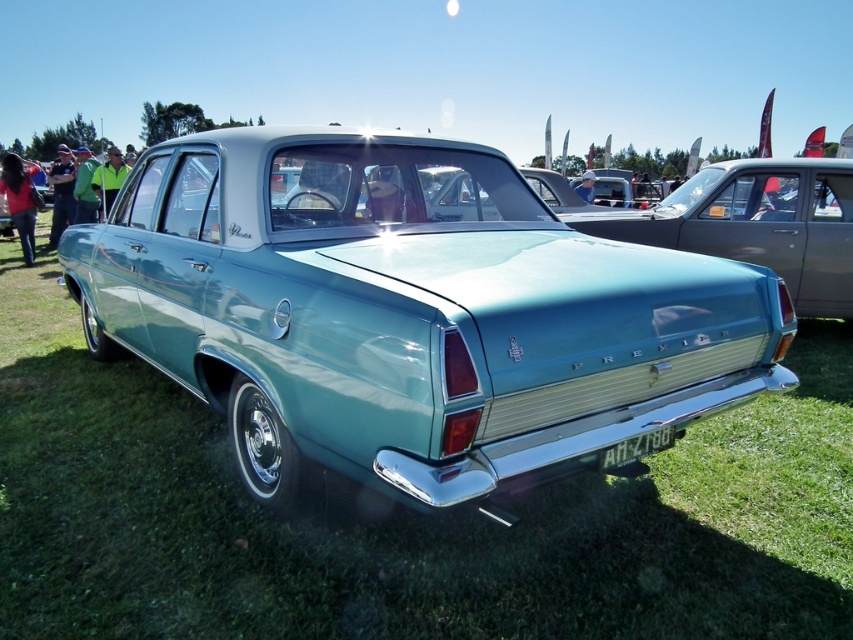
Between teal glossy sedan at center and white plastic license plate at center, which one has more height?

Standing taller between the two is teal glossy sedan at center.

Is teal glossy sedan at center positioned in front of white plastic license plate at center?

Yes, it is.

Is point (746, 276) positioned before point (635, 451)?

No, (746, 276) is behind (635, 451).

The image size is (853, 640). Find the location of `teal glossy sedan at center`. teal glossy sedan at center is located at coordinates (408, 312).